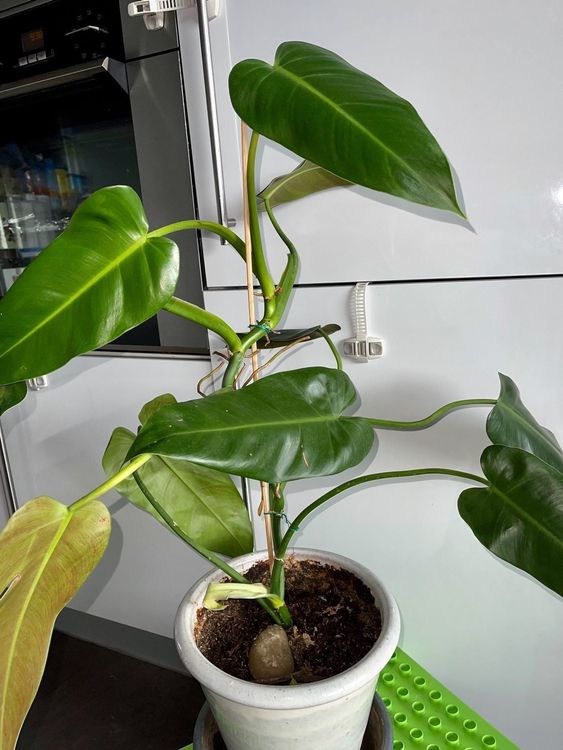
At what (x,y) coordinates should I click in order to perform the action: click on wall. Please return your answer as a coordinate pair (x, y). Looking at the image, I should click on click(426, 538).